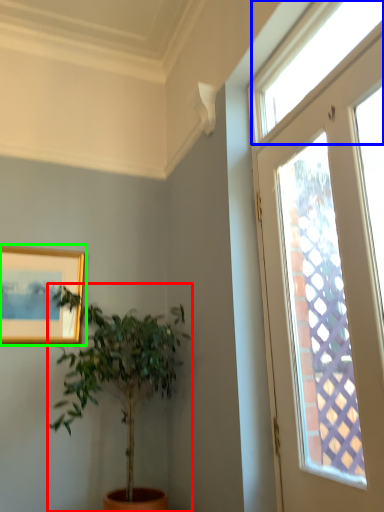
Question: Based on their relative distances, which object is farther from houseplant (highlighted by a red box)? Choose from window (highlighted by a blue box) and picture frame (highlighted by a green box).

Choices:
 (A) window
 (B) picture frame

Answer: (A)